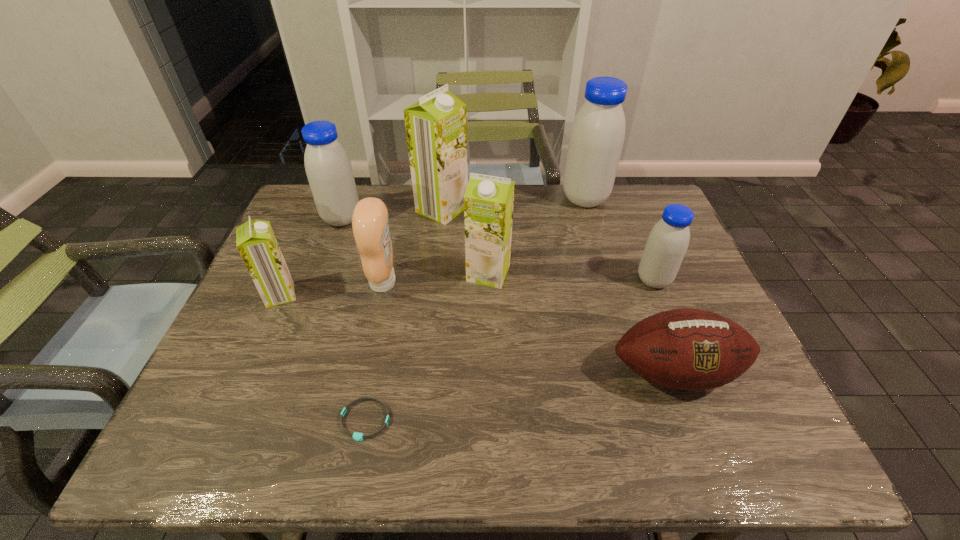
The image size is (960, 540). Identify the location of empty space between the biggest blue soya milk and the smallest blue soya milk. (619, 240).

This screenshot has height=540, width=960. I want to click on vacant point located between the leftmost green soya milk and the brown football (American), so tap(477, 334).

This screenshot has height=540, width=960. In order to click on free space between the brown football (American) and the biggest blue soya milk in this screenshot , I will do `click(630, 286)`.

Find the location of `free spot between the sixth object from left to right and the shortest object`. free spot between the sixth object from left to right and the shortest object is located at coordinates (427, 347).

Locate which object is the sixth closest to the smallest green soya milk. Please provide its 2D coordinates. Your answer should be formatted as a tuple, i.e. [(x, y)], where the tuple contains the x and y coordinates of a point satisfying the conditions above.

[(687, 349)]

Locate an element on the screen. The image size is (960, 540). object that stands as the closest to the leftmost blue soya milk is located at coordinates (436, 126).

Where is `soya milk that can be found as the fourth closest to the leftmost blue soya milk`? The image size is (960, 540). soya milk that can be found as the fourth closest to the leftmost blue soya milk is located at coordinates (597, 134).

Where is `the fourth closest soya milk to the brown football (American)`? The image size is (960, 540). the fourth closest soya milk to the brown football (American) is located at coordinates (436, 126).

Choose which blue soya milk is the second nearest neighbor to the condiment. Please provide its 2D coordinates. Your answer should be formatted as a tuple, i.e. [(x, y)], where the tuple contains the x and y coordinates of a point satisfying the conditions above.

[(597, 134)]

Point out which blue soya milk is positioned as the second nearest to the leftmost blue soya milk. Please provide its 2D coordinates. Your answer should be formatted as a tuple, i.e. [(x, y)], where the tuple contains the x and y coordinates of a point satisfying the conditions above.

[(667, 243)]